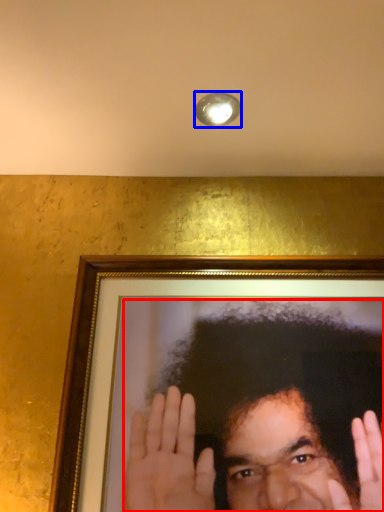
Question: Among these objects, which one is farthest to the camera, man (highlighted by a red box) or light fixture (highlighted by a blue box)?

Choices:
 (A) man
 (B) light fixture

Answer: (B)